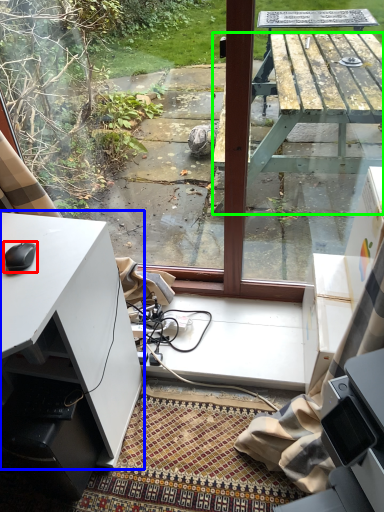
Question: Which object is the closest to the mouse (highlighted by a red box)? Choose among these: desk (highlighted by a blue box) or table (highlighted by a green box).

Choices:
 (A) desk
 (B) table

Answer: (A)